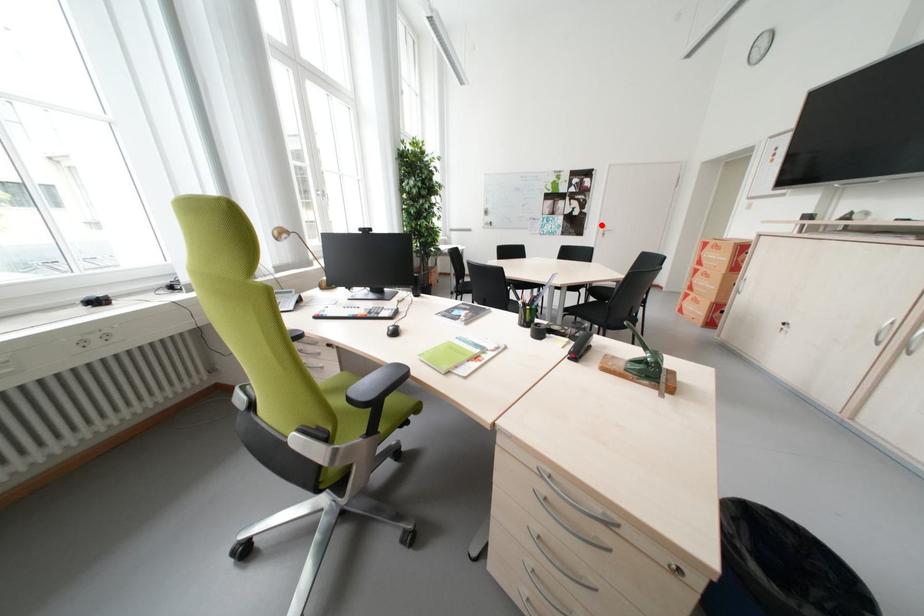
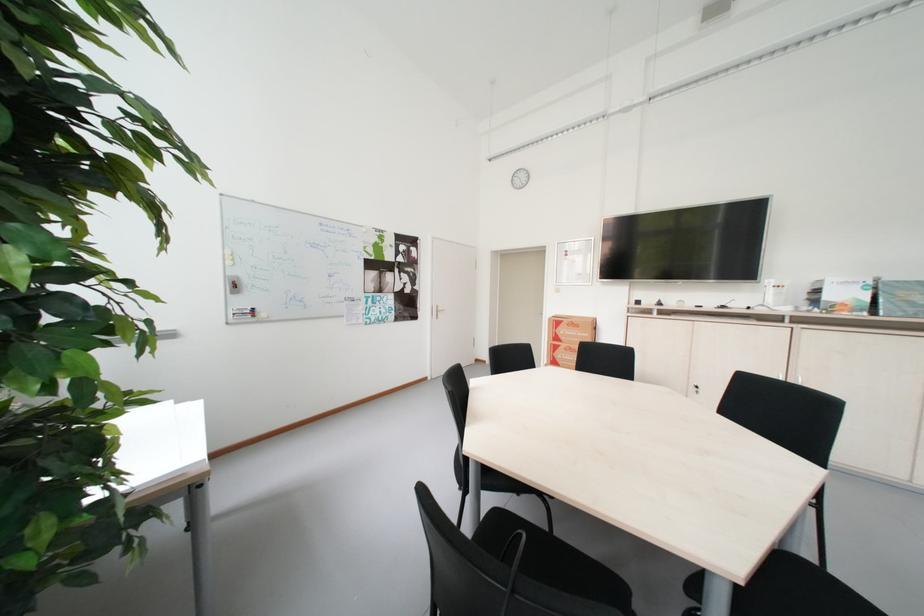
Question: I am providing you with two images of the same scene from different viewpoints. Image1 has a red point marked. In image2, the corresponding 3D location appears at what relative position? Reply with the corresponding letter.

Choices:
 (A) Closer
 (B) Farther

Answer: (B)